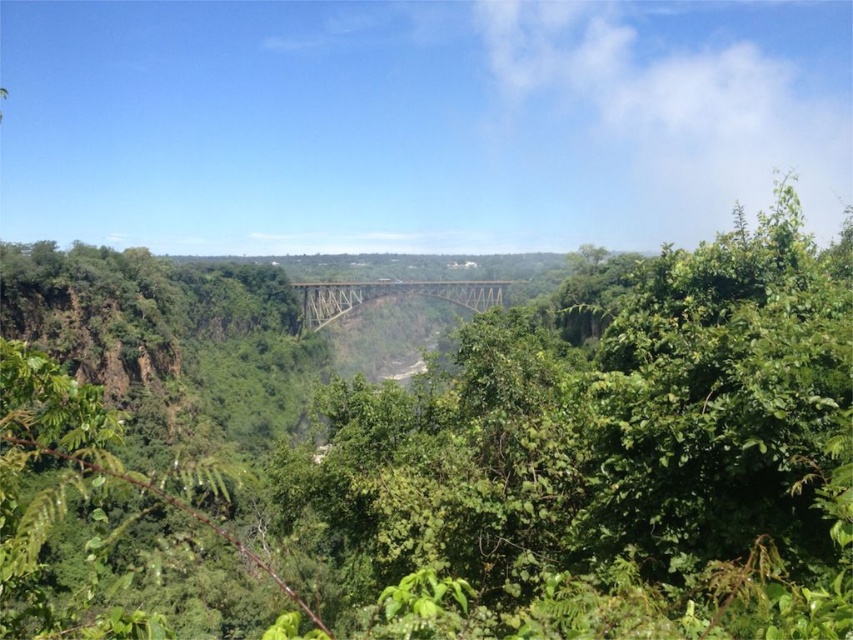
Between green leafy tree at center and metallic bridge at center, which one has more height?

Standing taller between the two is green leafy tree at center.

What do you see at coordinates (485, 467) in the screenshot? I see `green leafy tree at center` at bounding box center [485, 467].

Is point (643, 515) farther from viewer compared to point (337, 296)?

No, (643, 515) is closer to viewer.

This screenshot has width=853, height=640. In order to click on green leafy tree at center in this screenshot , I will do (485, 467).